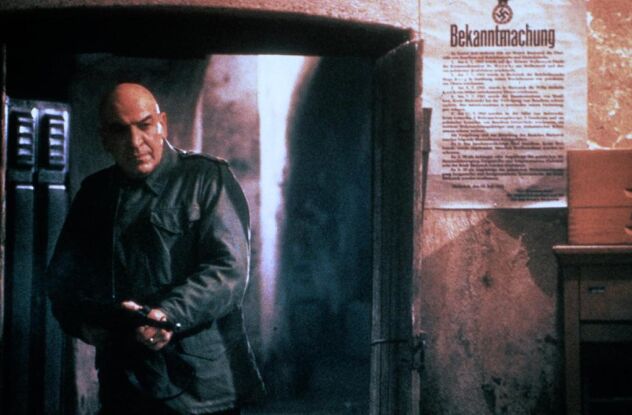
Where is `wooden end table`? wooden end table is located at coordinates (581, 248).